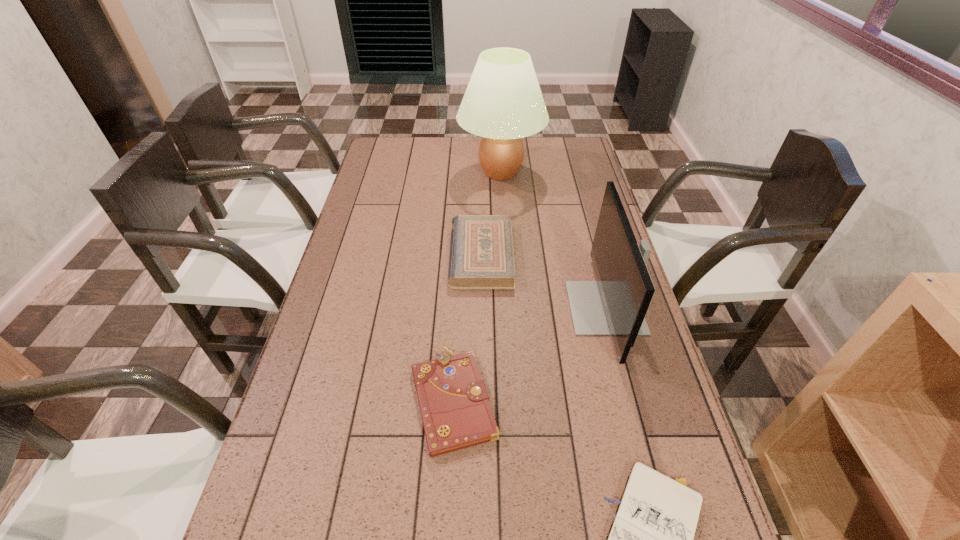
Locate an element on the screen. This screenshot has width=960, height=540. free space at the right edge of the desktop is located at coordinates (635, 401).

Locate an element on the screen. The image size is (960, 540). vacant space at the far left corner of the desktop is located at coordinates (396, 164).

At what (x,y) coordinates should I click in order to perform the action: click on free spot between the lampshade and the third tallest object. Please return your answer as a coordinate pair (x, y). Looking at the image, I should click on (491, 214).

You are a GUI agent. You are given a task and a screenshot of the screen. Output one action in this format:
    pyautogui.click(x=<x>, y=<y>)
    Task: Click on the vacant space that's between the computer monitor and the farthest object
    The height and width of the screenshot is (540, 960).
    Given the screenshot: What is the action you would take?
    pyautogui.click(x=553, y=240)

Identify the location of empty space between the Bible and the tallest object. (491, 214).

The height and width of the screenshot is (540, 960). I want to click on empty space that is in between the fourth shortest object and the left notebook, so click(530, 353).

Where is `object identified as the fourth closest to the shorter notebook`? Image resolution: width=960 pixels, height=540 pixels. object identified as the fourth closest to the shorter notebook is located at coordinates (503, 103).

Identify which object is located as the nearest to the farthest object. Please provide its 2D coordinates. Your answer should be formatted as a tuple, i.e. [(x, y)], where the tuple contains the x and y coordinates of a point satisfying the conditions above.

[(481, 256)]